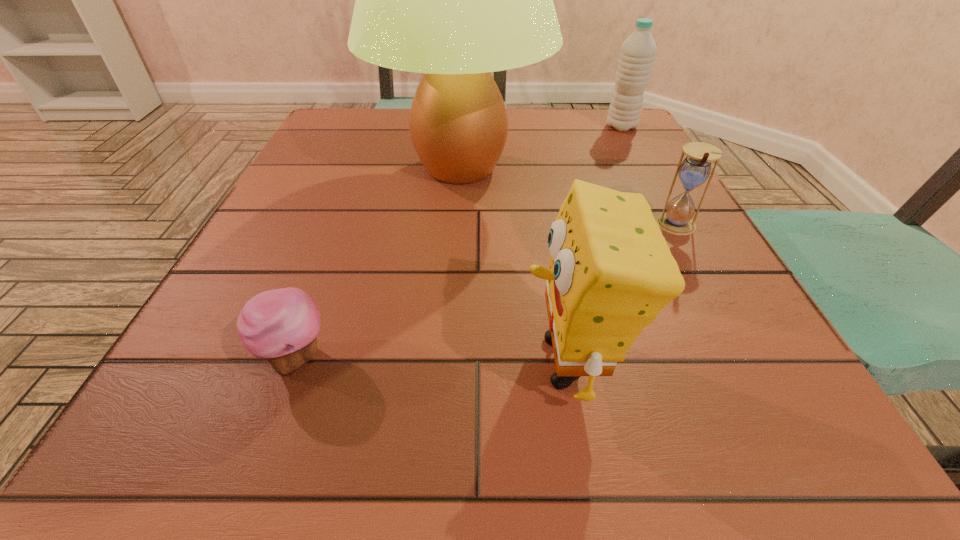
Locate an element on the screen. Image resolution: width=960 pixels, height=540 pixels. lampshade is located at coordinates (455, 0).

I want to click on water bottle, so click(x=638, y=51).

At what (x,y) coordinates should I click in order to perform the action: click on sponge. Please return your answer as a coordinate pair (x, y). Looking at the image, I should click on (611, 272).

The image size is (960, 540). Find the location of `the fourth tallest object`. the fourth tallest object is located at coordinates (695, 169).

This screenshot has width=960, height=540. In order to click on cupcake in this screenshot , I will do `click(281, 325)`.

Find the location of a particular element. This screenshot has height=540, width=960. free space located 0.050m on the shade of the lampshade is located at coordinates (572, 168).

This screenshot has height=540, width=960. What are the coordinates of `vacant space situated on the front of the water bottle` in the screenshot? It's located at (657, 192).

What are the coordinates of `free space located 0.330m on the face of the sponge` in the screenshot? It's located at (256, 362).

The width and height of the screenshot is (960, 540). In order to click on vacant space situated 0.330m on the face of the sponge in this screenshot , I will do `click(256, 362)`.

You are a GUI agent. You are given a task and a screenshot of the screen. Output one action in this format:
    pyautogui.click(x=<x>, y=<y>)
    Task: Click on the vacant space located on the face of the sponge
    This screenshot has width=960, height=540.
    Given the screenshot: What is the action you would take?
    pyautogui.click(x=385, y=362)